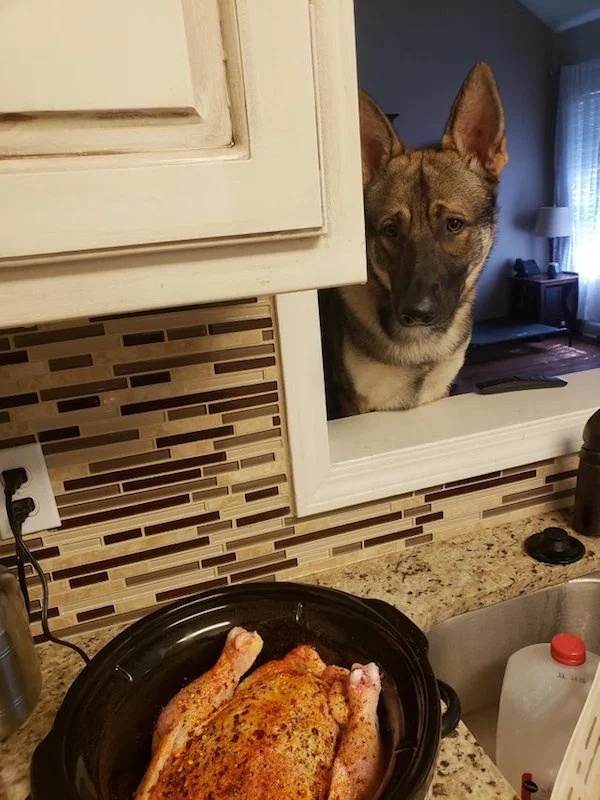
Locate an element on the screen. This screenshot has height=800, width=600. chicken in crockpot is located at coordinates (256, 748).